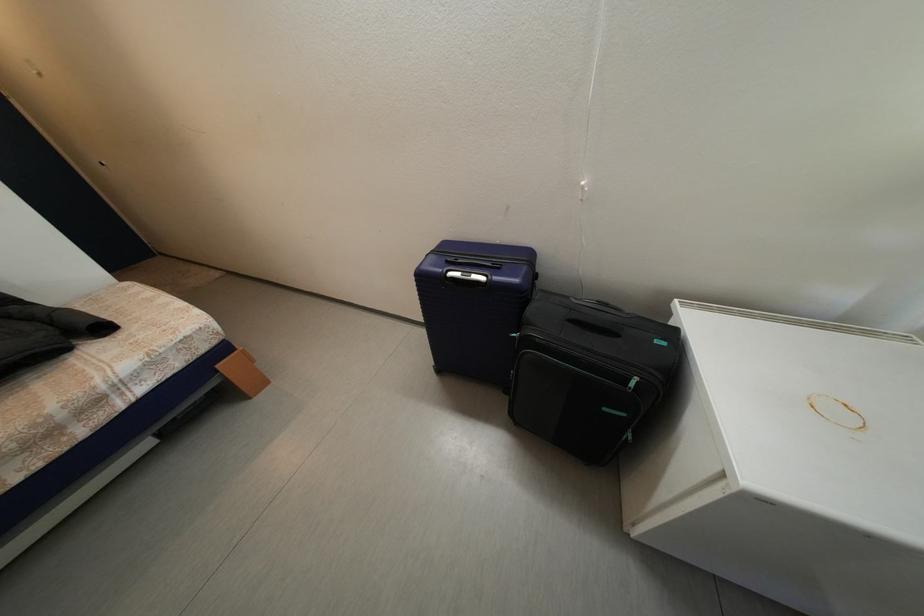
What do you see at coordinates (466, 277) in the screenshot? The image size is (924, 616). I see `the suitcase telescoping handle` at bounding box center [466, 277].